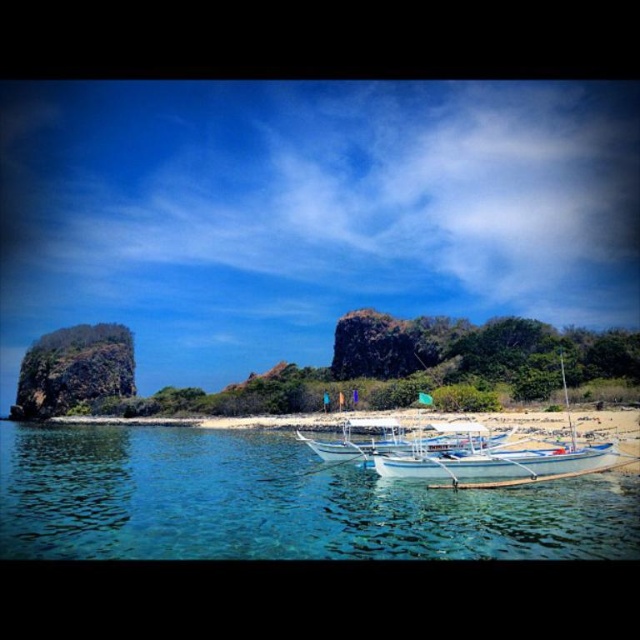
You are a photographer planning to capture the entire scene in one shot. Given that the white wooden boat at center is positioned closer to you than the clear blue water at lower center, will the boat appear larger or smaller in the photo compared to the water?

The boat will appear smaller in the photo because objects closer to the viewer generally appear larger, but since the clear blue water at lower center is farther away and its actual width is larger than the boat, it might still appear comparable in size depending on perspective. However, based on the description, the water is wider, so even at a distance, it could maintain a similar or larger apparent size. This requires considering both distance and actual size.

You are a photographer standing on the beach and want to capture both the clear blue water at lower center and the white wooden boat at center in your shot. Which object should you focus on first to ensure both are in frame?

The clear blue water at lower center is in front of the white wooden boat at center, so you should focus on the white wooden boat at center first to ensure both are in frame.